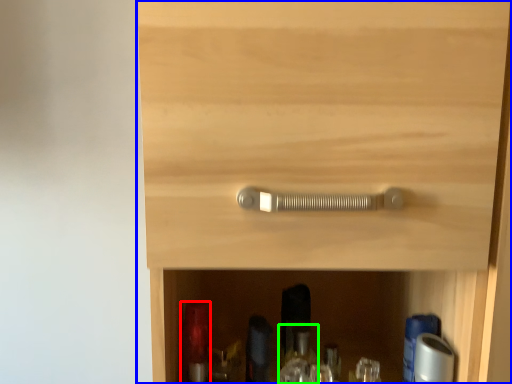
Question: Estimate the real-world distances between objects in this image. Which object is farther from bottle (highlighted by a red box), cupboard (highlighted by a blue box) or bottle (highlighted by a green box)?

Choices:
 (A) cupboard
 (B) bottle

Answer: (A)